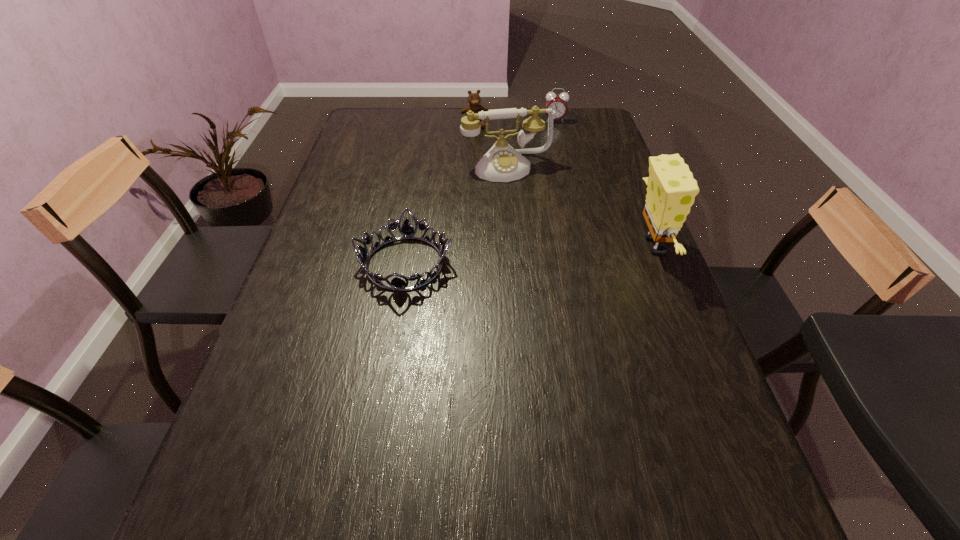
This screenshot has width=960, height=540. I want to click on free space between the telephone and the shortest object, so click(x=455, y=215).

Identify the location of free space between the rightmost object and the shortest object. This screenshot has height=540, width=960. (529, 254).

The width and height of the screenshot is (960, 540). Find the location of `empty space that is in between the rightmost object and the alarm clock`. empty space that is in between the rightmost object and the alarm clock is located at coordinates (604, 184).

Find the location of `empty location between the teddy bear and the tallest object`. empty location between the teddy bear and the tallest object is located at coordinates (564, 185).

Locate an element on the screen. This screenshot has width=960, height=540. unoccupied area between the rightmost object and the shortest object is located at coordinates (529, 254).

Identify the location of empty location between the third farthest object and the rightmost object. (580, 206).

Locate an element on the screen. The image size is (960, 540). vacant space in between the alarm clock and the tiara is located at coordinates (480, 192).

Where is `free space between the second tallest object and the tiara`? The height and width of the screenshot is (540, 960). free space between the second tallest object and the tiara is located at coordinates (455, 215).

At what (x,y) coordinates should I click in order to perform the action: click on free space between the telephone and the second object from right to left. Please return your answer as a coordinate pair (x, y). This screenshot has width=960, height=540. Looking at the image, I should click on (530, 144).

Locate which object is the fourth closest to the telephone. Please provide its 2D coordinates. Your answer should be formatted as a tuple, i.e. [(x, y)], where the tuple contains the x and y coordinates of a point satisfying the conditions above.

[(407, 231)]